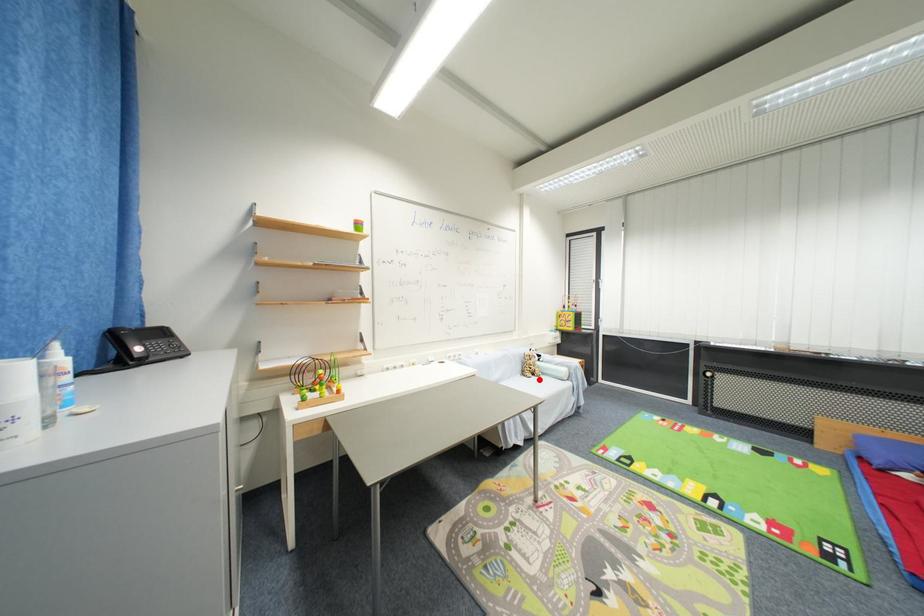
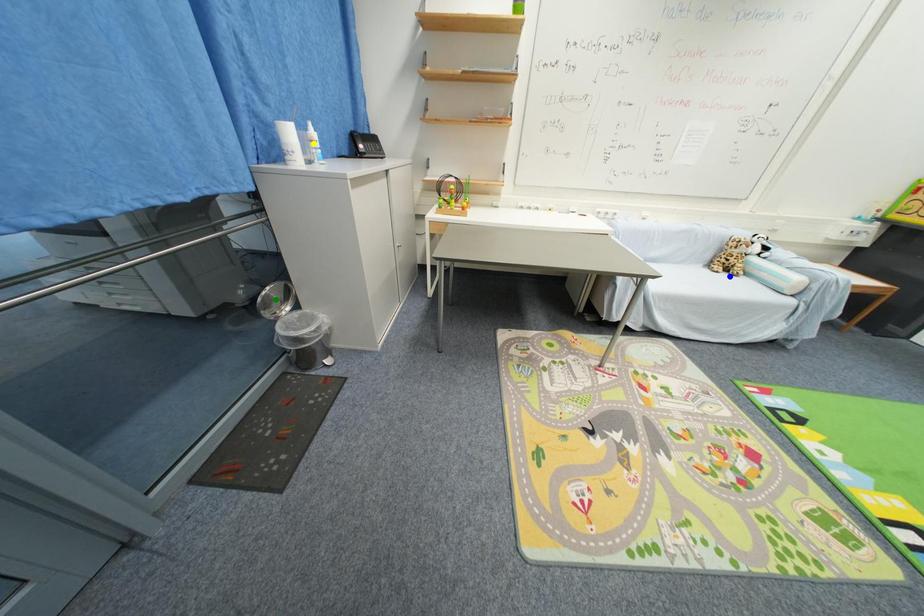
Question: I am providing you with two images of the same scene from different viewpoints. A red point is marked on the first image. You are given multiple points on the second image. Which spot in image 2 lines up with the point in image 1?

Choices:
 (A) green point
 (B) blue point
 (C) yellow point

Answer: (B)